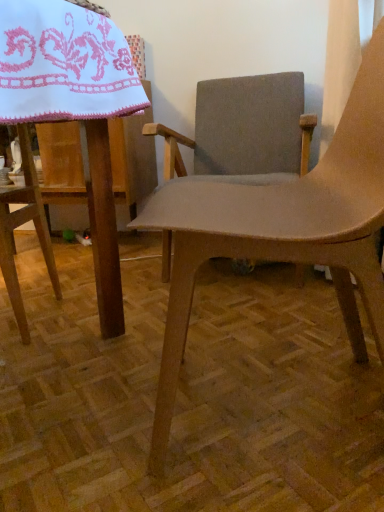
Where is `matte brown chair at center, the 1th chair when ordered from front to back`? This screenshot has width=384, height=512. matte brown chair at center, the 1th chair when ordered from front to back is located at coordinates tap(283, 230).

Describe the element at coordinates (64, 64) in the screenshot. I see `white embroidered cloth at upper left` at that location.

Where is `matte brown chair at center, the second chair positioned from the back`? This screenshot has height=512, width=384. matte brown chair at center, the second chair positioned from the back is located at coordinates pos(283,230).

Image resolution: width=384 pixels, height=512 pixels. Identify the location of blanket located above the matte brown chair at center, the second chair positioned from the back (from the image's perspective). (64, 64).

Is white embroidered cloth at upper left at the back of matte brown chair at center, the second chair positioned from the back?

No, matte brown chair at center, the second chair positioned from the back,'s orientation is not away from white embroidered cloth at upper left.

Does point (206, 184) appear closer or farther from the camera than point (24, 82)?

Point (206, 184) is farther from the camera than point (24, 82).

Which of these two, textured gray fabric chair at center, the first chair when ordered from back to front, or white embroidered cloth at upper left, stands shorter?

With less height is white embroidered cloth at upper left.

Is textured gray fabric chair at center, the first chair when ordered from back to front, oriented towards white embroidered cloth at upper left?

Yes, textured gray fabric chair at center, the first chair when ordered from back to front, is aimed at white embroidered cloth at upper left.

Between textured gray fabric chair at center, arranged as the second chair when viewed from the front, and white embroidered cloth at upper left, which one has smaller size?

white embroidered cloth at upper left is smaller.

Does textured gray fabric chair at center, arranged as the second chair when viewed from the front, contain matte brown chair at center, the 1th chair when ordered from front to back?

No.

Is textured gray fabric chair at center, the first chair when ordered from back to front, beside matte brown chair at center, the 1th chair when ordered from front to back?

No, textured gray fabric chair at center, the first chair when ordered from back to front, is not beside matte brown chair at center, the 1th chair when ordered from front to back.

From a real-world perspective, is textured gray fabric chair at center, the first chair when ordered from back to front, positioned over matte brown chair at center, the second chair positioned from the back, based on gravity?

Correct, in the physical world, textured gray fabric chair at center, the first chair when ordered from back to front, is higher than matte brown chair at center, the second chair positioned from the back.

Does textured gray fabric chair at center, the first chair when ordered from back to front, have a larger size compared to matte brown chair at center, the second chair positioned from the back?

Indeed, textured gray fabric chair at center, the first chair when ordered from back to front, has a larger size compared to matte brown chair at center, the second chair positioned from the back.

Looking at their sizes, would you say white embroidered cloth at upper left is wider or thinner than textured gray fabric chair at center, the first chair when ordered from back to front?

Considering their sizes, white embroidered cloth at upper left looks slimmer than textured gray fabric chair at center, the first chair when ordered from back to front.

What's the angular difference between white embroidered cloth at upper left and textured gray fabric chair at center, arranged as the second chair when viewed from the front,'s facing directions?

The angle between the facing direction of white embroidered cloth at upper left and the facing direction of textured gray fabric chair at center, arranged as the second chair when viewed from the front, is 88.8 degrees.

Which is behind, point (23, 18) or point (204, 158)?

The point (204, 158) is farther.

From a real-world perspective, is white embroidered cloth at upper left over matte brown chair at center, the 1th chair when ordered from front to back?

Yes, from a real-world perspective, white embroidered cloth at upper left is above matte brown chair at center, the 1th chair when ordered from front to back.

Looking at their sizes, would you say white embroidered cloth at upper left is wider or thinner than matte brown chair at center, the second chair positioned from the back?

Clearly, white embroidered cloth at upper left has more width compared to matte brown chair at center, the second chair positioned from the back.

In the scene shown: Choose the correct answer: Is white embroidered cloth at upper left inside matte brown chair at center, the 1th chair when ordered from front to back, or outside it?

white embroidered cloth at upper left lies outside matte brown chair at center, the 1th chair when ordered from front to back.

Between point (133, 104) and point (178, 257), which one is positioned in front?

The point (178, 257) is closer.

Based on the photo, how many degrees apart are the facing directions of matte brown chair at center, the 1th chair when ordered from front to back, and textured gray fabric chair at center, arranged as the second chair when viewed from the front?

The angle between the facing direction of matte brown chair at center, the 1th chair when ordered from front to back, and the facing direction of textured gray fabric chair at center, arranged as the second chair when viewed from the front, is 84.9 degrees.

From a real-world perspective, is matte brown chair at center, the second chair positioned from the back, beneath textured gray fabric chair at center, arranged as the second chair when viewed from the front?

Yes, from a real-world perspective, matte brown chair at center, the second chair positioned from the back, is under textured gray fabric chair at center, arranged as the second chair when viewed from the front.

Is matte brown chair at center, the second chair positioned from the back, further to the viewer compared to textured gray fabric chair at center, the first chair when ordered from back to front?

No, the depth of matte brown chair at center, the second chair positioned from the back, is less than that of textured gray fabric chair at center, the first chair when ordered from back to front.

The height and width of the screenshot is (512, 384). What are the coordinates of `blanket above the matte brown chair at center, the second chair positioned from the back (from the image's perspective)` in the screenshot? It's located at (64, 64).

The width and height of the screenshot is (384, 512). In the image, there is a textured gray fabric chair at center, arranged as the second chair when viewed from the front. Find the location of `blanket below it (from the image's perspective)`. blanket below it (from the image's perspective) is located at coordinates (64, 64).

When comparing their distances from matte brown chair at center, the 1th chair when ordered from front to back, does textured gray fabric chair at center, arranged as the second chair when viewed from the front, or white embroidered cloth at upper left seem further?

Among the two, textured gray fabric chair at center, arranged as the second chair when viewed from the front, is located further to matte brown chair at center, the 1th chair when ordered from front to back.

When comparing their distances from matte brown chair at center, the 1th chair when ordered from front to back, does white embroidered cloth at upper left or textured gray fabric chair at center, arranged as the second chair when viewed from the front, seem further?

textured gray fabric chair at center, arranged as the second chair when viewed from the front.

Considering their positions, is matte brown chair at center, the 1th chair when ordered from front to back, positioned closer to textured gray fabric chair at center, arranged as the second chair when viewed from the front, than white embroidered cloth at upper left?

Among the two, matte brown chair at center, the 1th chair when ordered from front to back, is located nearer to textured gray fabric chair at center, arranged as the second chair when viewed from the front.

From the image, which object appears to be nearer to white embroidered cloth at upper left, matte brown chair at center, the second chair positioned from the back, or textured gray fabric chair at center, arranged as the second chair when viewed from the front?

matte brown chair at center, the second chair positioned from the back, is positioned closer to the anchor white embroidered cloth at upper left.

From the image, which object appears to be farther from white embroidered cloth at upper left, textured gray fabric chair at center, arranged as the second chair when viewed from the front, or matte brown chair at center, the 1th chair when ordered from front to back?

textured gray fabric chair at center, arranged as the second chair when viewed from the front, is further to white embroidered cloth at upper left.

Estimate the real-world distances between objects in this image. Which object is closer to textured gray fabric chair at center, the first chair when ordered from back to front, white embroidered cloth at upper left or matte brown chair at center, the second chair positioned from the back?

The object closer to textured gray fabric chair at center, the first chair when ordered from back to front, is matte brown chair at center, the second chair positioned from the back.

Identify the location of chair located between white embroidered cloth at upper left and textured gray fabric chair at center, arranged as the second chair when viewed from the front, in the depth direction. (283, 230).